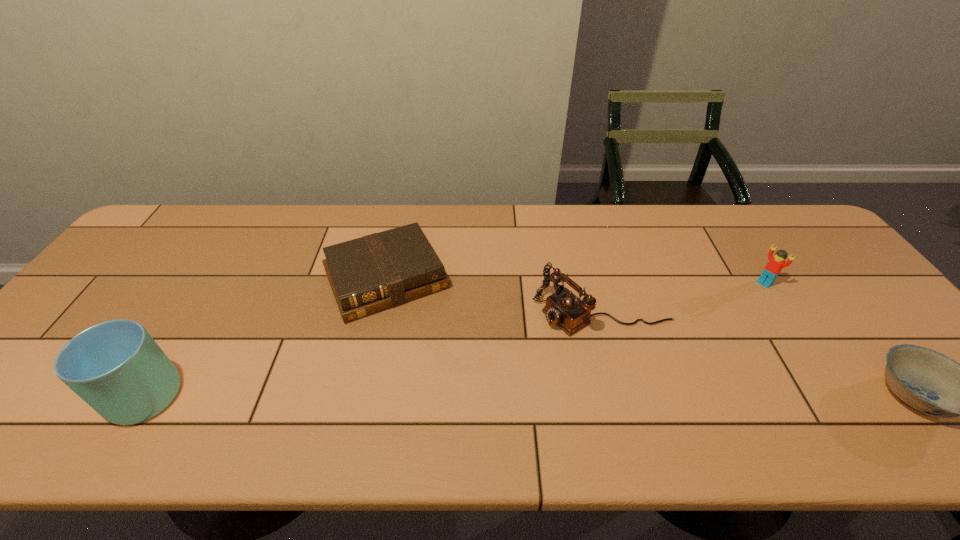
Identify the location of free location located 0.150m on the spine side of the Bible. (431, 363).

In order to click on vacant space situated on the spine side of the Bible in this screenshot , I will do `click(428, 357)`.

Find the location of a particular element. blank space located 0.350m on the face of the second object from right to left is located at coordinates (684, 348).

Find the location of `vacant region located 0.100m on the face of the second object from right to left`. vacant region located 0.100m on the face of the second object from right to left is located at coordinates (741, 303).

Where is `free space located 0.220m on the face of the second object from right to left`? Image resolution: width=960 pixels, height=540 pixels. free space located 0.220m on the face of the second object from right to left is located at coordinates (715, 323).

This screenshot has width=960, height=540. What are the coordinates of `object that is at the far edge` in the screenshot? It's located at (381, 270).

Identify the location of object at the near edge. Image resolution: width=960 pixels, height=540 pixels. pos(116,367).

Locate an element on the screen. This screenshot has height=540, width=960. vacant space at the far edge of the desktop is located at coordinates (672, 211).

The image size is (960, 540). I want to click on free space at the near edge of the desktop, so click(x=450, y=383).

This screenshot has width=960, height=540. In order to click on free space at the left edge of the desktop in this screenshot , I will do `click(92, 298)`.